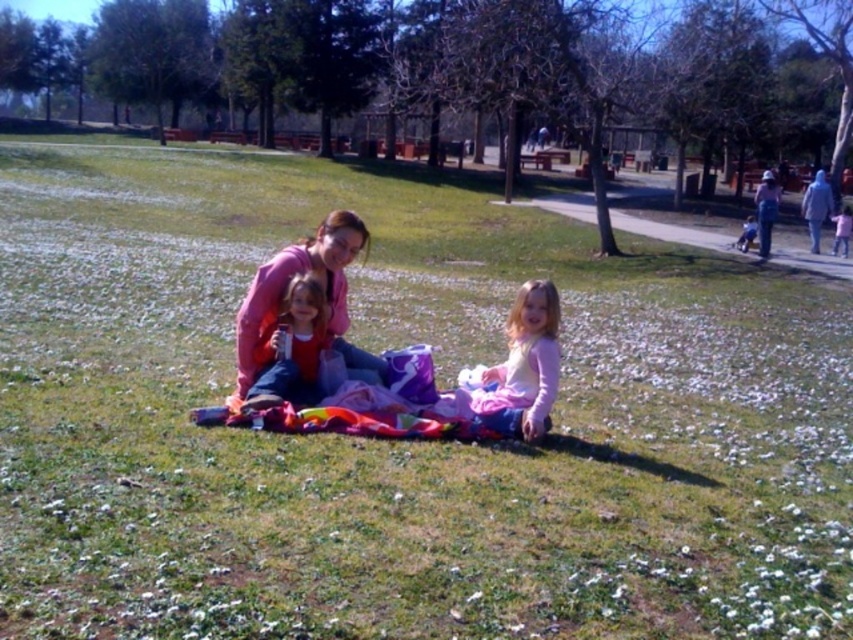
Question: Which of the following is the farthest from the observer?

Choices:
 (A) pink fabric dress at center
 (B) light blue fabric at right
 (C) light pink fabric at lower right

Answer: (C)

Question: Is pink fabric dress at center positioned behind pink fabric at lower right?

Choices:
 (A) yes
 (B) no

Answer: (B)

Question: Which object appears closest to the camera in this image?

Choices:
 (A) pink fleece jacket at center
 (B) denim jacket at right
 (C) light pink fabric at lower right

Answer: (A)

Question: Can you confirm if pink fabric dress at center is thinner than denim jacket at right?

Choices:
 (A) yes
 (B) no

Answer: (A)

Question: Estimate the real-world distances between objects in this image. Which object is farther from the pink fleece jacket at center?

Choices:
 (A) light pink fabric at lower right
 (B) denim jacket at right
 (C) pink fabric dress at center

Answer: (B)

Question: Does pink fabric dress at center appear on the left side of light pink fabric at lower right?

Choices:
 (A) yes
 (B) no

Answer: (A)